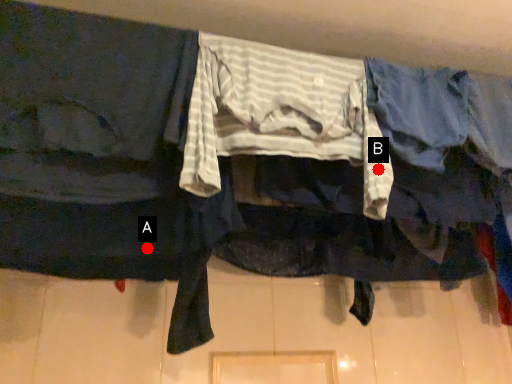
Question: Two points are circled on the image, labeled by A and B beside each circle. Which point appears farthest from the camera in this image?

Choices:
 (A) A is further
 (B) B is further

Answer: (B)